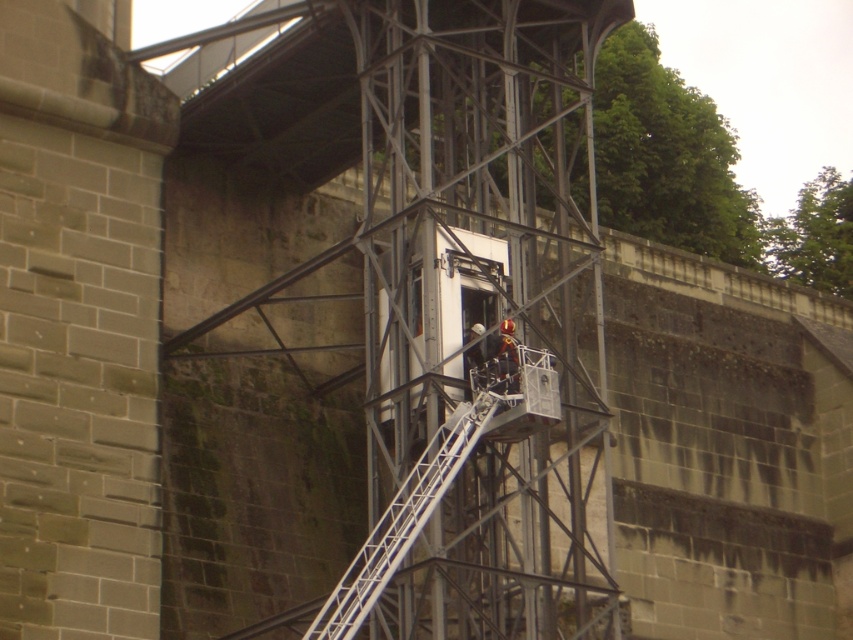
Question: Does metallic silver ladder at center have a greater width compared to orange safety helmet at center?

Choices:
 (A) no
 (B) yes

Answer: (A)

Question: Which point is farther to the camera?

Choices:
 (A) coord(503,356)
 (B) coord(392,504)

Answer: (A)

Question: Can you confirm if metallic silver ladder at center is positioned above orange safety helmet at center?

Choices:
 (A) no
 (B) yes

Answer: (A)

Question: Does metallic silver ladder at center appear on the right side of orange safety helmet at center?

Choices:
 (A) yes
 (B) no

Answer: (B)

Question: Which of the following is the farthest from the observer?

Choices:
 (A) metallic silver ladder at center
 (B) orange safety helmet at center

Answer: (B)